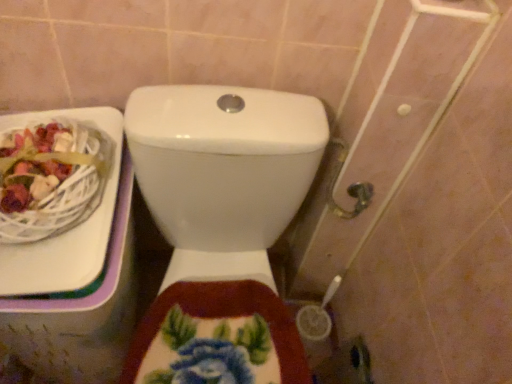
You are a GUI agent. You are given a task and a screenshot of the screen. Output one action in this format:
    pyautogui.click(x=<x>, y=<y>)
    Task: Click on the white glossy toilet at center
    This screenshot has height=384, width=512.
    Given the screenshot: What is the action you would take?
    pyautogui.click(x=223, y=208)

Image resolution: width=512 pixels, height=384 pixels. What do you see at coordinates (223, 208) in the screenshot?
I see `white glossy toilet at center` at bounding box center [223, 208].

What do you see at coordinates (58, 198) in the screenshot?
I see `white wicker basket at upper left` at bounding box center [58, 198].

Measure the distance between white wicker basket at upper left and camera.

white wicker basket at upper left and camera are 25.87 inches apart from each other.

Locate an element on the screen. Image resolution: width=512 pixels, height=384 pixels. white wicker basket at upper left is located at coordinates (58, 198).

You are a GUI agent. You are given a task and a screenshot of the screen. Output one action in this format:
    pyautogui.click(x=<x>, y=<y>)
    Task: Click on the white glossy toilet at center
    
    Given the screenshot: What is the action you would take?
    pyautogui.click(x=223, y=208)

Between white glossy toilet at center and white wicker basket at upper left, which one appears on the right side from the viewer's perspective?

white glossy toilet at center.

Which object is closer to the camera taking this photo, white glossy toilet at center or white wicker basket at upper left?

Positioned in front is white glossy toilet at center.

Is point (221, 231) farther from viewer compared to point (48, 191)?

Yes, it is behind point (48, 191).

From the image's perspective, would you say white glossy toilet at center is shown under white wicker basket at upper left?

Yes, from the image's perspective, white glossy toilet at center is below white wicker basket at upper left.

From a real-world perspective, between white glossy toilet at center and white wicker basket at upper left, who is vertically lower?

From a 3D spatial view, white glossy toilet at center is below.

From the picture: Is white glossy toilet at center thinner than white wicker basket at upper left?

Incorrect, the width of white glossy toilet at center is not less than that of white wicker basket at upper left.

Considering the sizes of white glossy toilet at center and white wicker basket at upper left in the image, is white glossy toilet at center taller or shorter than white wicker basket at upper left?

Considering their sizes, white glossy toilet at center has more height than white wicker basket at upper left.

Is white glossy toilet at center bigger than white wicker basket at upper left?

Indeed, white glossy toilet at center has a larger size compared to white wicker basket at upper left.

Can white wicker basket at upper left be found inside white glossy toilet at center?

No.

Would you consider white glossy toilet at center to be distant from white wicker basket at upper left?

That's not correct — white glossy toilet at center is a little close to white wicker basket at upper left.

From the picture: Is white glossy toilet at center oriented away from white wicker basket at upper left?

No, white glossy toilet at center is not facing away from white wicker basket at upper left.

How many degrees apart are the facing directions of white glossy toilet at center and white wicker basket at upper left?

There is a 0.236-degree angle between the facing directions of white glossy toilet at center and white wicker basket at upper left.

How distant is white glossy toilet at center from white wicker basket at upper left?

They are 8.26 inches apart.

The width and height of the screenshot is (512, 384). Find the location of `sink located behind the white glossy toilet at center`. sink located behind the white glossy toilet at center is located at coordinates (58, 198).

Considering the relative positions of white wicker basket at upper left and white glossy toilet at center in the image provided, is white wicker basket at upper left to the right of white glossy toilet at center from the viewer's perspective?

In fact, white wicker basket at upper left is to the left of white glossy toilet at center.

Considering the relative positions of white wicker basket at upper left and white glossy toilet at center in the image provided, is white wicker basket at upper left in front of white glossy toilet at center?

No, white wicker basket at upper left is behind white glossy toilet at center.

Is point (87, 280) closer or farther from the camera than point (140, 138)?

Clearly, point (87, 280) is closer to the camera than point (140, 138).

From the image's perspective, is white wicker basket at upper left over white glossy toilet at center?

Indeed, from the image's perspective, white wicker basket at upper left is shown above white glossy toilet at center.

From a real-world perspective, is white wicker basket at upper left on top of white glossy toilet at center?

Indeed, from a real-world perspective, white wicker basket at upper left stands above white glossy toilet at center.

Considering the sizes of objects white wicker basket at upper left and white glossy toilet at center in the image provided, who is wider, white wicker basket at upper left or white glossy toilet at center?

With larger width is white glossy toilet at center.

Is white wicker basket at upper left shorter than white glossy toilet at center?

Yes.

Based on the photo, considering the sizes of objects white wicker basket at upper left and white glossy toilet at center in the image provided, who is bigger, white wicker basket at upper left or white glossy toilet at center?

With larger size is white glossy toilet at center.

Can we say white wicker basket at upper left lies outside white glossy toilet at center?

white wicker basket at upper left lies outside white glossy toilet at center's area.

Is white wicker basket at upper left far from white glossy toilet at center?

No.

Could you tell me if white wicker basket at upper left is turned towards white glossy toilet at center?

No, white wicker basket at upper left is not turned towards white glossy toilet at center.

How many degrees apart are the facing directions of white wicker basket at upper left and white glossy toilet at center?

There is a 0.236-degree angle between the facing directions of white wicker basket at upper left and white glossy toilet at center.

Find the location of `sink above the white glossy toilet at center (from the image's perspective)`. sink above the white glossy toilet at center (from the image's perspective) is located at coordinates (58, 198).

Find the location of `toilet that is on the right side of white wicker basket at upper left`. toilet that is on the right side of white wicker basket at upper left is located at coordinates (223, 208).

Find the location of a particular element. This screenshot has width=512, height=384. sink above the white glossy toilet at center (from a real-world perspective) is located at coordinates (58, 198).